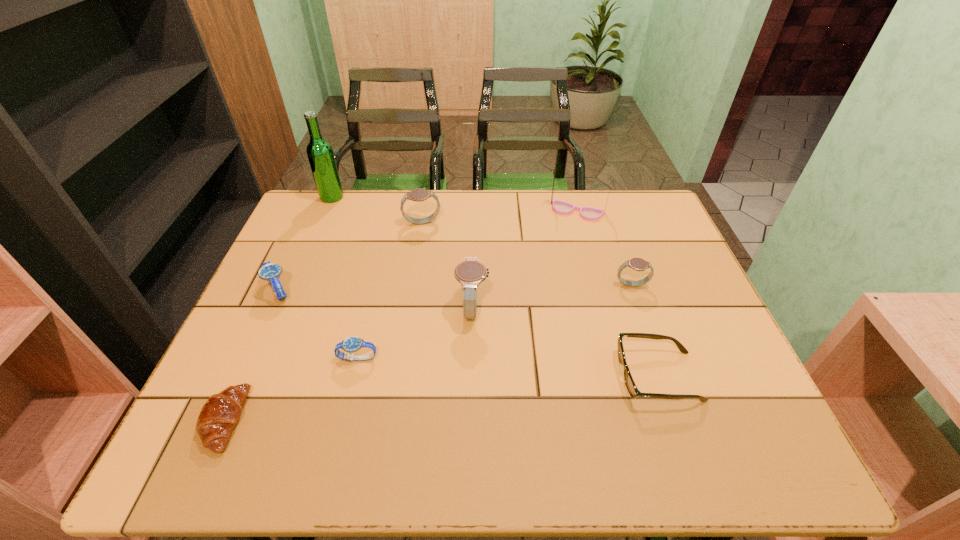
You are a GUI agent. You are given a task and a screenshot of the screen. Output one action in this format:
    pyautogui.click(x=<x>, y=<y>)
    Task: Click on the leftmost watch
    This screenshot has height=540, width=960.
    Given the screenshot: What is the action you would take?
    pyautogui.click(x=271, y=272)

You are a GUI agent. You are given a task and a screenshot of the screen. Output one action in this format:
    pyautogui.click(x=<x>, y=<y>)
    Task: Click on the left blue watch
    
    Given the screenshot: What is the action you would take?
    pyautogui.click(x=271, y=272)

This screenshot has height=540, width=960. Identify the location of the nearer spectacles. (630, 384).

Where is `the shortest watch`? The height and width of the screenshot is (540, 960). the shortest watch is located at coordinates (351, 344).

Where is `the nearer blue watch`? The width and height of the screenshot is (960, 540). the nearer blue watch is located at coordinates [x=351, y=344].

Locate an element on the screen. Image resolution: width=960 pixels, height=540 pixels. crescent roll is located at coordinates (219, 415).

Locate an element on the screen. free space located on the right of the tallest object is located at coordinates pyautogui.click(x=404, y=197).

In order to click on free space located on the back of the pink spectacles in this screenshot , I will do `click(570, 190)`.

This screenshot has height=540, width=960. Identify the location of vacant space located on the left of the biggest gray watch. (300, 309).

What are the coordinates of `free space located on the back of the leftmost gray watch` in the screenshot? It's located at (425, 203).